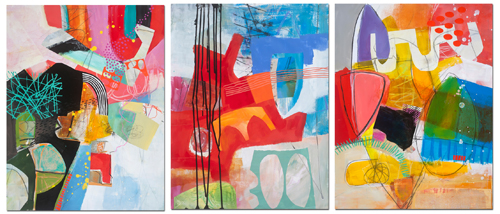
The image size is (500, 214). I want to click on pictures, so click(98, 14), click(291, 16), click(414, 10).